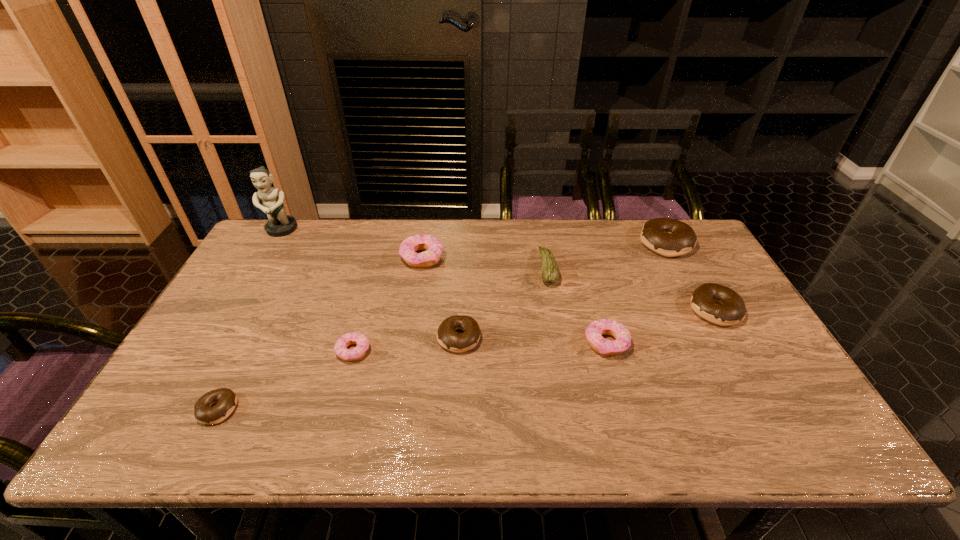
Locate an element on the screen. This screenshot has height=540, width=960. green figurine is located at coordinates (279, 224).

Locate an element on the screen. This screenshot has width=960, height=540. figurine is located at coordinates (279, 224).

The width and height of the screenshot is (960, 540). I want to click on the tallest doughnut, so click(x=668, y=237).

What are the coordinates of `the farthest brown doughnut` in the screenshot? It's located at (668, 237).

Where is `green zucchini`? green zucchini is located at coordinates (550, 273).

Locate an element on the screen. This screenshot has height=540, width=960. zucchini is located at coordinates [550, 273].

The height and width of the screenshot is (540, 960). Identify the location of the sixth object from right to left. (434, 247).

You are a GUI agent. You are given a task and a screenshot of the screen. Output one action in this format:
    pyautogui.click(x=<x>, y=<y>)
    Task: Click on the biggest pink doughnut
    This screenshot has width=960, height=540.
    Given the screenshot: What is the action you would take?
    click(x=434, y=247)

Identify the location of the second biggest brown doughnut. (732, 311).

The height and width of the screenshot is (540, 960). In order to click on the fifth doughnut from left to right in this screenshot , I will do `click(595, 330)`.